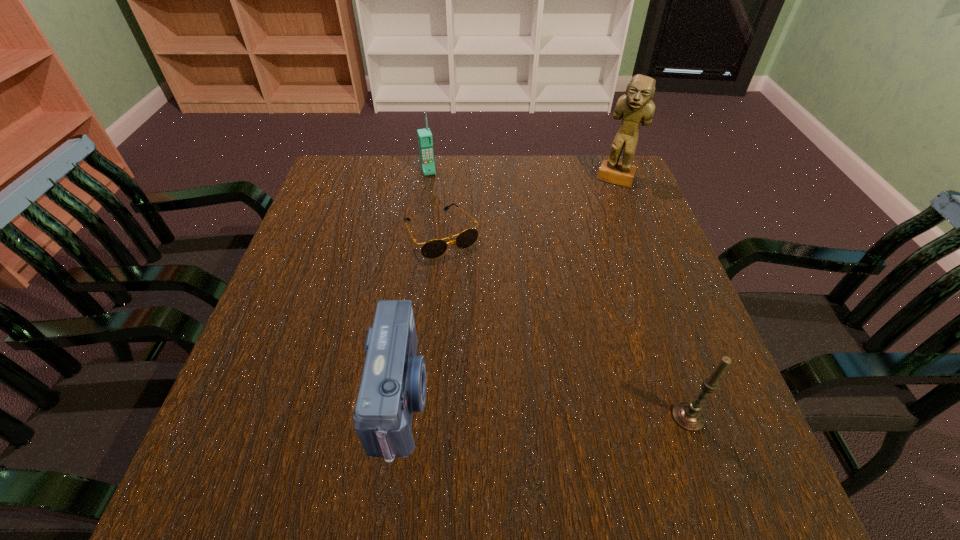
Find the location of `candle present at the near edge`. candle present at the near edge is located at coordinates (688, 415).

Locate an element on the screen. This screenshot has width=960, height=540. candle positioned at the right edge is located at coordinates (688, 415).

Find the location of a particular element. This screenshot has height=540, width=960. figurine that is at the right edge is located at coordinates (636, 106).

This screenshot has height=540, width=960. What are the coordinates of `object at the far right corner` in the screenshot? It's located at (636, 106).

This screenshot has height=540, width=960. Identify the location of object that is positioned at the near right corner. (688, 415).

The image size is (960, 540). In the image, there is a desktop. Find the location of `blank space at the far edge`. blank space at the far edge is located at coordinates (507, 174).

Where is `vacant space at the near edge`? vacant space at the near edge is located at coordinates (437, 395).

Locate an element on the screen. Image resolution: width=960 pixels, height=540 pixels. vacant area at the left edge is located at coordinates (293, 266).

Locate an element on the screen. free space at the right edge of the desktop is located at coordinates (665, 278).

This screenshot has height=540, width=960. In the image, there is a desktop. What are the coordinates of `blank space at the far left corner` in the screenshot? It's located at (341, 189).